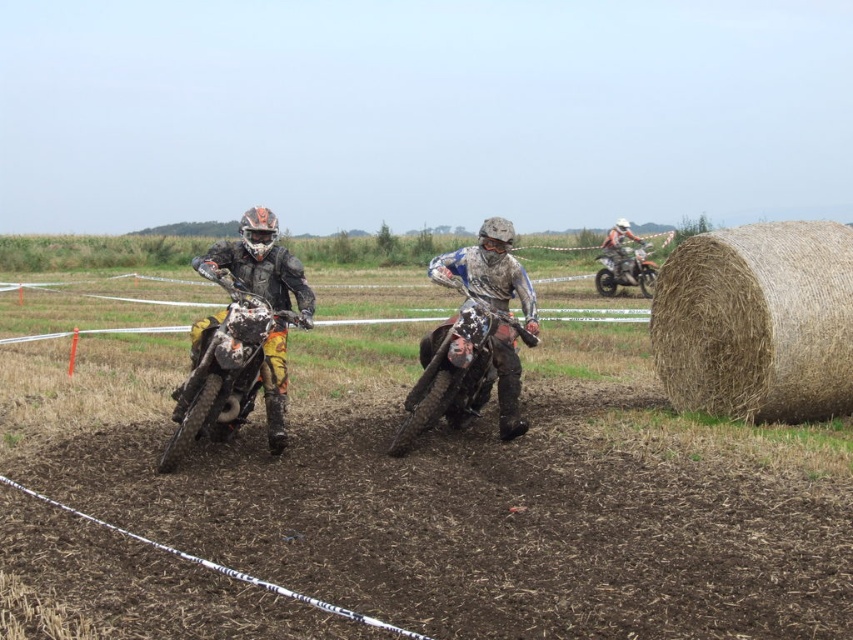
Question: Which of the following is the farthest from the observer?

Choices:
 (A) orange and white motocross gear at right
 (B) matte orange and white motorcycle at left
 (C) orange matte dirt bike at right
 (D) matte black dirt bike at center

Answer: (C)

Question: Is brown straw bale at right to the right of orange and white motocross gear at right from the viewer's perspective?

Choices:
 (A) no
 (B) yes

Answer: (A)

Question: Which of the following is the farthest from the observer?

Choices:
 (A) matte orange and white motorcycle at left
 (B) orange matte dirt bike at right

Answer: (B)

Question: Is the position of matte black dirt bike at center less distant than that of orange and white motocross gear at right?

Choices:
 (A) yes
 (B) no

Answer: (A)

Question: Does matte orange and white motorcycle at left have a lesser width compared to matte black dirt bike at center?

Choices:
 (A) no
 (B) yes

Answer: (A)

Question: Among these objects, which one is nearest to the camera?

Choices:
 (A) brown straw bale at right
 (B) orange matte dirt bike at right

Answer: (A)